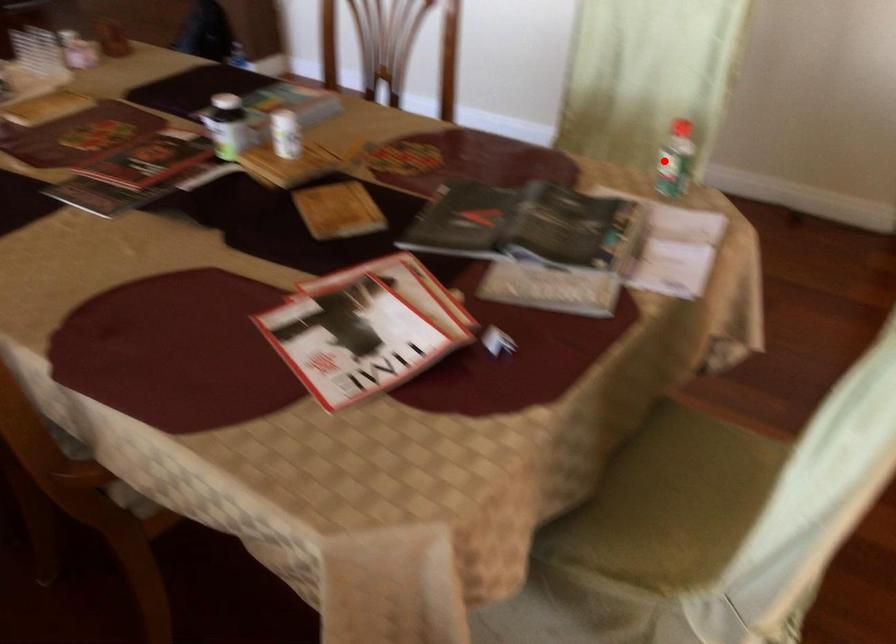
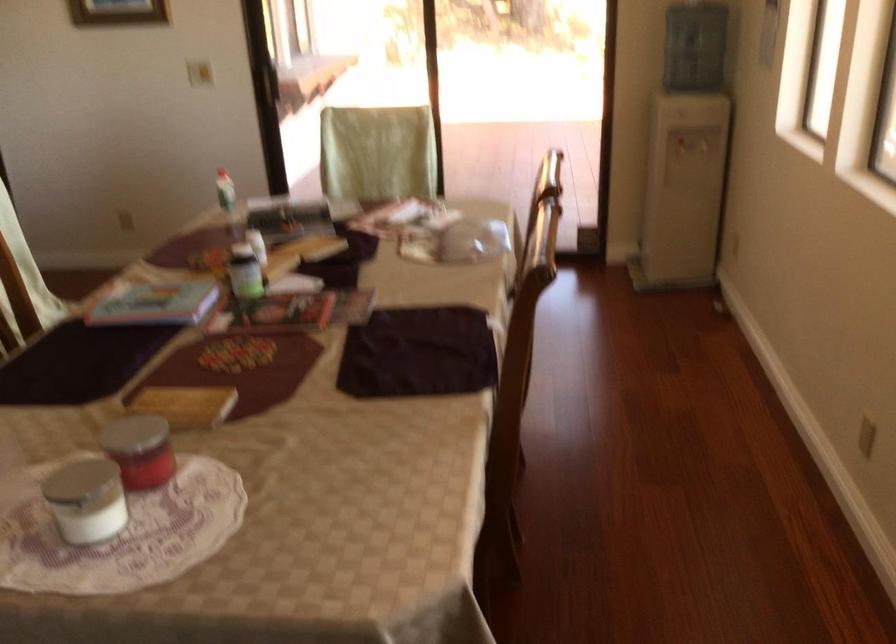
The point at the highlighted location is marked in the first image. Where is the corresponding point in the second image?

(225, 190)